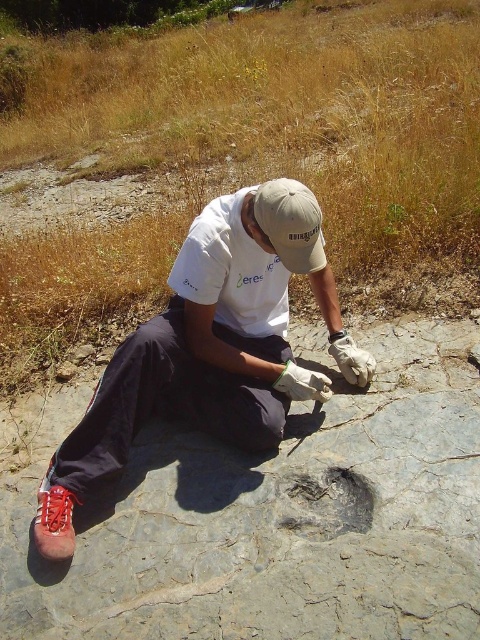
From the picture: You are a geologist who just found a fossil. You need to take a photo of the gray stone fossil at center and the white cotton shirt at center in the same frame. Which object should you position to the left side of your camera frame to include both in the photo?

The white cotton shirt at center should be positioned to the left side of the camera frame because the gray stone fossil at center is to the right of the white cotton shirt at center, so placing the shirt on the left allows both to fit within the frame.